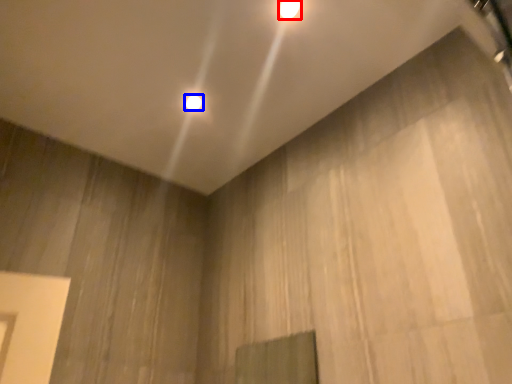
Question: Which of the following is the farthest to the observer, lamp (highlighted by a red box) or lamp (highlighted by a blue box)?

Choices:
 (A) lamp
 (B) lamp

Answer: (B)